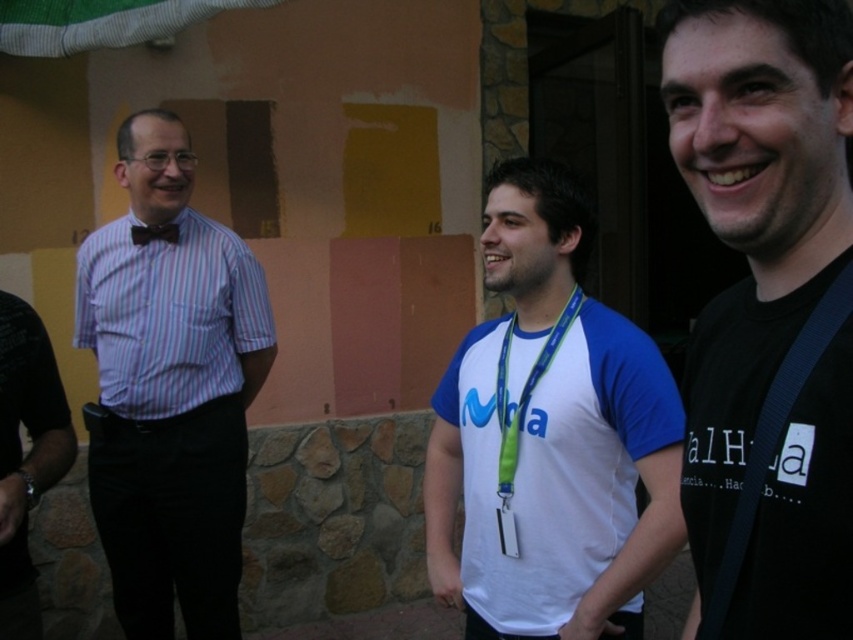
Does white fabric shirt at center have a smaller size compared to green fabric lanyard at center?

No, white fabric shirt at center is not smaller than green fabric lanyard at center.

What do you see at coordinates (556, 481) in the screenshot?
I see `white fabric shirt at center` at bounding box center [556, 481].

Is point (503, 266) less distant than point (508, 410)?

That is False.

This screenshot has width=853, height=640. I want to click on white fabric shirt at center, so click(556, 481).

The width and height of the screenshot is (853, 640). What do you see at coordinates (769, 312) in the screenshot? I see `black matte shirt at center` at bounding box center [769, 312].

Between point (813, 113) and point (567, 288), which one is positioned behind?

Point (567, 288)

The width and height of the screenshot is (853, 640). I want to click on black matte shirt at center, so pos(769,312).

Based on the photo, does black matte shirt at center have a larger size compared to black satin bow tie at center?

Yes, black matte shirt at center is bigger than black satin bow tie at center.

Where is `black matte shirt at center`? The height and width of the screenshot is (640, 853). black matte shirt at center is located at coordinates (769, 312).